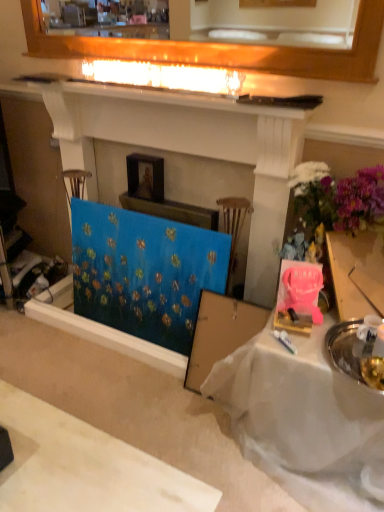
Where is `free space to the left of blue fabric painting at center`? Image resolution: width=384 pixels, height=512 pixels. free space to the left of blue fabric painting at center is located at coordinates (57, 351).